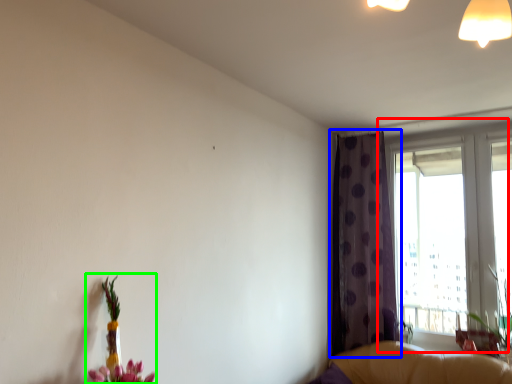
Question: Considering the real-world distances, which object is closest to window (highlighted by a red box)? curtain (highlighted by a blue box) or floral arrangement (highlighted by a green box).

Choices:
 (A) curtain
 (B) floral arrangement

Answer: (A)